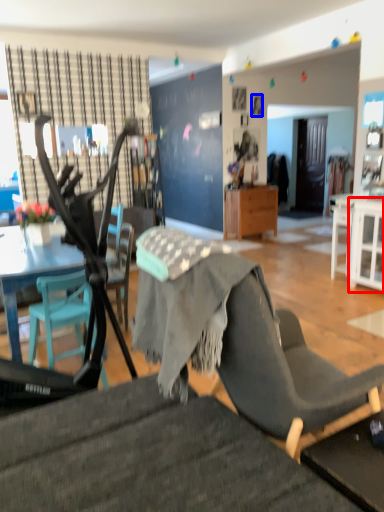
Question: Which of the following is the closest to the observer, cabinetry (highlighted by a red box) or picture frame (highlighted by a blue box)?

Choices:
 (A) cabinetry
 (B) picture frame

Answer: (A)